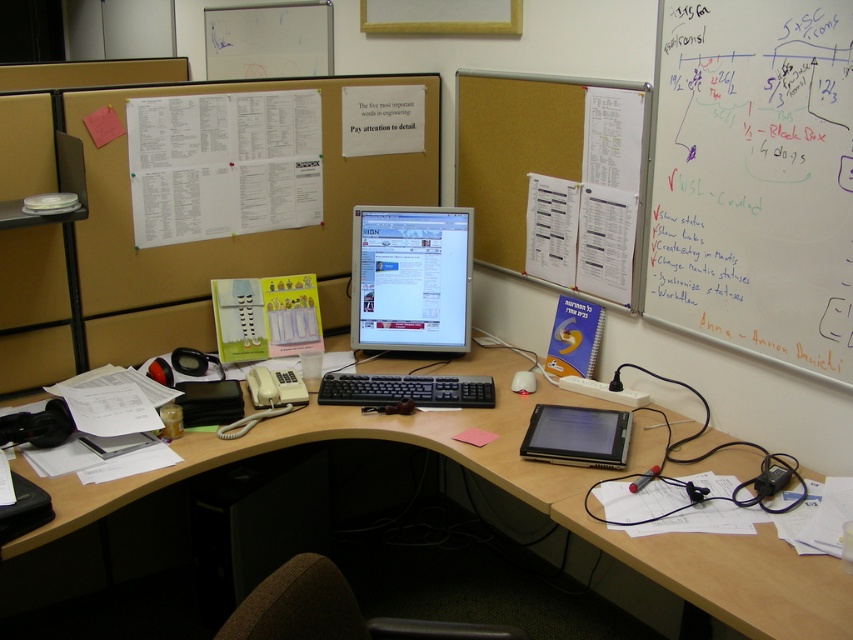
Question: Estimate the real-world distances between objects in this image. Which object is farther from the black glossy tablet at center?

Choices:
 (A) wooden computer desk at center
 (B) pink paper at center
 (C) corkboard at upper right
 (D) black plastic keyboard at center

Answer: (C)

Question: Which object is farther from the camera taking this photo?

Choices:
 (A) matte black monitor at center
 (B) black glossy tablet at center

Answer: (A)

Question: Which object is closer to the camera taking this photo?

Choices:
 (A) wooden computer desk at center
 (B) corkboard at upper right

Answer: (A)

Question: Is matte black monitor at center positioned in front of black glossy tablet at center?

Choices:
 (A) yes
 (B) no

Answer: (B)

Question: Can you confirm if whiteboard at upper right is bigger than wooden computer desk at center?

Choices:
 (A) yes
 (B) no

Answer: (B)

Question: Does whiteboard at upper right have a larger size compared to corkboard at upper right?

Choices:
 (A) no
 (B) yes

Answer: (A)